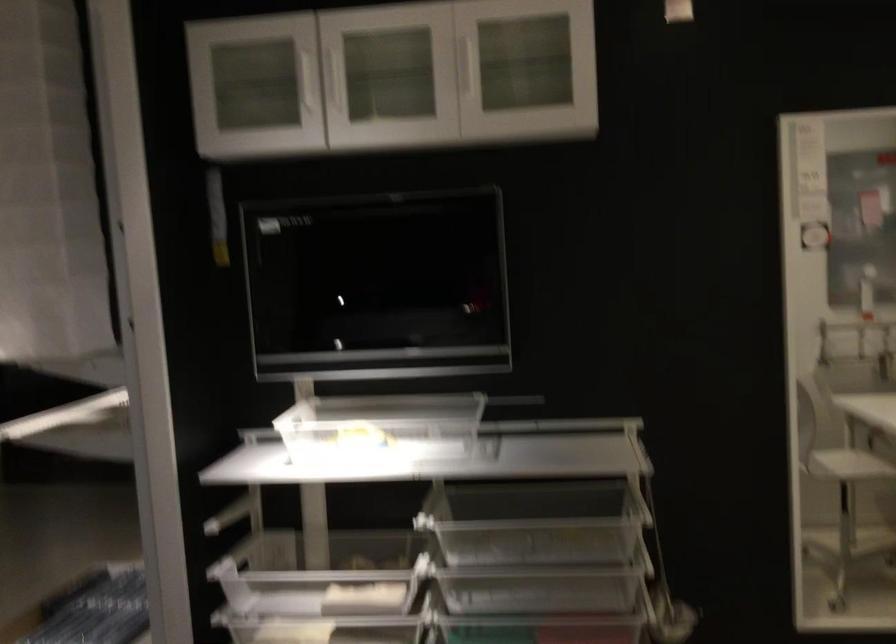
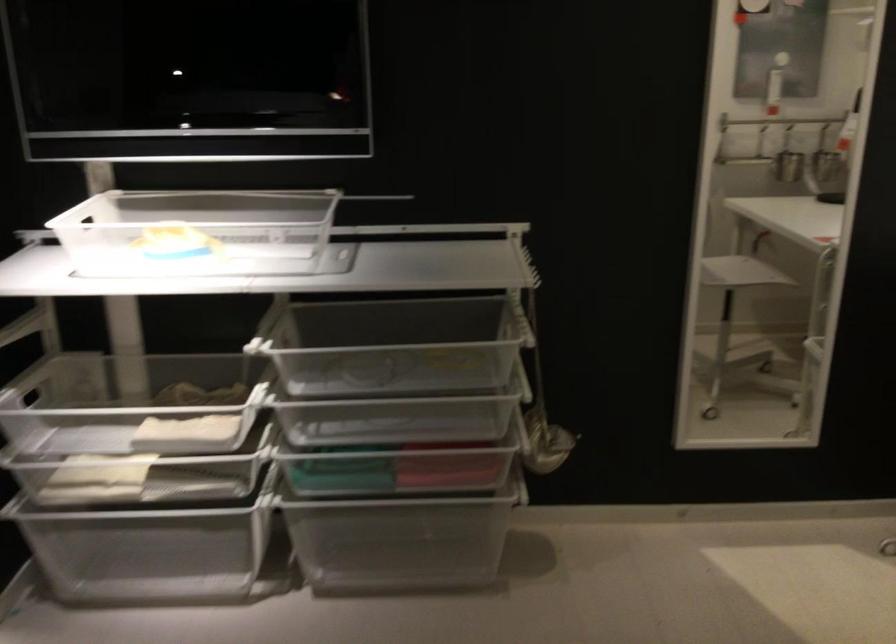
Where in the second image is the point corresponding to the point at 533,576 from the first image?

(397, 406)